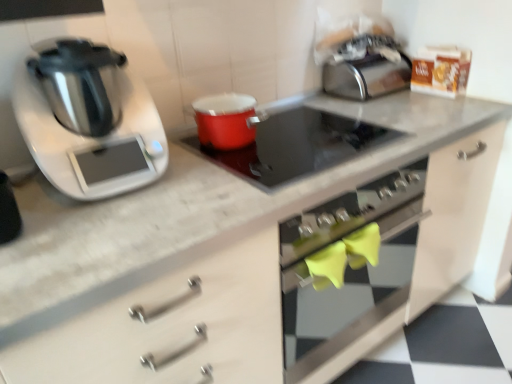
You are a GUI agent. You are given a task and a screenshot of the screen. Output one action in this format:
    pyautogui.click(x=<x>, y=<y>)
    Task: Click on the matte red pot at center
    This screenshot has width=512, height=384.
    Given the screenshot: What is the action you would take?
    pyautogui.click(x=226, y=120)

Measure the distance between point (x=354, y=50) and camera.

Point (x=354, y=50) is 5.39 feet from camera.

The width and height of the screenshot is (512, 384). What do you see at coordinates (366, 68) in the screenshot?
I see `satin silver toaster at upper right` at bounding box center [366, 68].

Locate an element on the screen. The image size is (512, 384). smooth glass cooktop at center is located at coordinates (296, 146).

Considering their positions, is matte red pot at center located in front of or behind shiny metallic pressure cooker at left?

Visually, matte red pot at center is located behind shiny metallic pressure cooker at left.

Is matte red pot at center turned away from shiny metallic pressure cooker at left?

That's not correct — matte red pot at center is not looking away from shiny metallic pressure cooker at left.

Is matte red pot at center spatially inside shiny metallic pressure cooker at left, or outside of it?

matte red pot at center is not inside shiny metallic pressure cooker at left, it's outside.

Between matte red pot at center and shiny metallic pressure cooker at left, which one has smaller width?

With smaller width is matte red pot at center.

What's the angular difference between satin silver toaster at upper right and matte red pot at center's facing directions?

The angle between the facing direction of satin silver toaster at upper right and the facing direction of matte red pot at center is 0.000762 degrees.

From a real-world perspective, which is physically below, satin silver toaster at upper right or matte red pot at center?

In real-world perspective, matte red pot at center is lower.

From the image's perspective, who appears lower, satin silver toaster at upper right or matte red pot at center?

matte red pot at center appears lower in the image.

Considering the sizes of objects shiny metallic pressure cooker at left and satin silver toaster at upper right in the image provided, who is thinner, shiny metallic pressure cooker at left or satin silver toaster at upper right?

satin silver toaster at upper right.

Considering the positions of point (87, 169) and point (371, 66), is point (87, 169) closer or farther from the camera than point (371, 66)?

Clearly, point (87, 169) is closer to the camera than point (371, 66).

You are a GUI agent. You are given a task and a screenshot of the screen. Output one action in this format:
    pyautogui.click(x=<x>, y=<y>)
    Task: Click on the kitchen appliance in front of the satin silver toaster at upper right
    
    Given the screenshot: What is the action you would take?
    pyautogui.click(x=88, y=120)

Is shiny metallic pressure cooker at left with satin silver toaster at upper right?

No, shiny metallic pressure cooker at left is not beside satin silver toaster at upper right.

Is matte red pot at center taller than satin silver toaster at upper right?

Incorrect, the height of matte red pot at center is not larger of that of satin silver toaster at upper right.

Which object is thinner, matte red pot at center or satin silver toaster at upper right?

With smaller width is satin silver toaster at upper right.

The width and height of the screenshot is (512, 384). Find the location of `appliance that appears below the satin silver toaster at upper right (from the image's perspective)`. appliance that appears below the satin silver toaster at upper right (from the image's perspective) is located at coordinates (226, 120).

Does matte red pot at center lie behind satin silver toaster at upper right?

No, it is in front of satin silver toaster at upper right.

The width and height of the screenshot is (512, 384). Find the location of `appliance above the smooth glass cooktop at center (from the image's perspective)`. appliance above the smooth glass cooktop at center (from the image's perspective) is located at coordinates (226, 120).

Which of these two, matte red pot at center or smooth glass cooktop at center, is wider?

Wider between the two is smooth glass cooktop at center.

Measure the distance between matte red pot at center and smooth glass cooktop at center.

matte red pot at center and smooth glass cooktop at center are 6.29 inches apart.

Based on the photo, is matte red pot at center far from smooth glass cooktop at center?

That's not correct — matte red pot at center is a little close to smooth glass cooktop at center.

Choose the correct answer: Is satin silver toaster at upper right inside shiny metallic pressure cooker at left or outside it?

satin silver toaster at upper right is not inside shiny metallic pressure cooker at left, it's outside.

Can you tell me how much satin silver toaster at upper right and shiny metallic pressure cooker at left differ in facing direction?

There is a 0.00152-degree angle between the facing directions of satin silver toaster at upper right and shiny metallic pressure cooker at left.

From the image's perspective, is satin silver toaster at upper right located beneath shiny metallic pressure cooker at left?

Incorrect, from the image's perspective, satin silver toaster at upper right is higher than shiny metallic pressure cooker at left.

Is satin silver toaster at upper right far away from shiny metallic pressure cooker at left?

No, satin silver toaster at upper right is not far away from shiny metallic pressure cooker at left.

Is satin silver toaster at upper right taller or shorter than smooth glass cooktop at center?

In the image, satin silver toaster at upper right appears to be taller than smooth glass cooktop at center.

In the scene shown: From the image's perspective, which one is positioned lower, satin silver toaster at upper right or smooth glass cooktop at center?

smooth glass cooktop at center is shown below in the image.

Is the position of satin silver toaster at upper right more distant than that of smooth glass cooktop at center?

Yes, the depth of satin silver toaster at upper right is greater than that of smooth glass cooktop at center.

Considering the sizes of satin silver toaster at upper right and smooth glass cooktop at center in the image, is satin silver toaster at upper right wider or thinner than smooth glass cooktop at center?

Considering their sizes, satin silver toaster at upper right looks slimmer than smooth glass cooktop at center.

This screenshot has height=384, width=512. I want to click on kitchen appliance that appears below the matte red pot at center (from the image's perspective), so click(88, 120).

Locate an element on the screen. Image resolution: width=512 pixels, height=384 pixels. toaster lying on the right of matte red pot at center is located at coordinates (366, 68).

Estimate the real-world distances between objects in this image. Which object is further from smooth glass cooktop at center, matte red pot at center or shiny metallic pressure cooker at left?

Among the two, shiny metallic pressure cooker at left is located further to smooth glass cooktop at center.

When comparing their distances from smooth glass cooktop at center, does satin silver toaster at upper right or shiny metallic pressure cooker at left seem closer?

shiny metallic pressure cooker at left is positioned closer to the anchor smooth glass cooktop at center.

Which object lies nearer to the anchor point shiny metallic pressure cooker at left, satin silver toaster at upper right or smooth glass cooktop at center?

Among the two, smooth glass cooktop at center is located nearer to shiny metallic pressure cooker at left.

From the image, which object appears to be nearer to satin silver toaster at upper right, shiny metallic pressure cooker at left or smooth glass cooktop at center?

Among the two, smooth glass cooktop at center is located nearer to satin silver toaster at upper right.

Estimate the real-world distances between objects in this image. Which object is closer to satin silver toaster at upper right, smooth glass cooktop at center or matte red pot at center?

smooth glass cooktop at center is closer to satin silver toaster at upper right.

From the image, which object appears to be nearer to smooth glass cooktop at center, shiny metallic pressure cooker at left or satin silver toaster at upper right?

Among the two, shiny metallic pressure cooker at left is located nearer to smooth glass cooktop at center.

When comparing their distances from matte red pot at center, does smooth glass cooktop at center or satin silver toaster at upper right seem further?

satin silver toaster at upper right.

From the image, which object appears to be nearer to shiny metallic pressure cooker at left, smooth glass cooktop at center or satin silver toaster at upper right?

smooth glass cooktop at center.

Where is `appliance situated between shiny metallic pressure cooker at left and smooth glass cooktop at center from left to right`? This screenshot has width=512, height=384. appliance situated between shiny metallic pressure cooker at left and smooth glass cooktop at center from left to right is located at coordinates (226, 120).

Find the location of a particular element. The image size is (512, 384). appliance situated between shiny metallic pressure cooker at left and satin silver toaster at upper right from left to right is located at coordinates (226, 120).

Where is `gas stove between shiny metallic pressure cooker at left and satin silver toaster at upper right`? gas stove between shiny metallic pressure cooker at left and satin silver toaster at upper right is located at coordinates (296, 146).

Image resolution: width=512 pixels, height=384 pixels. In order to click on gas stove between matte red pot at center and satin silver toaster at upper right in the horizontal direction in this screenshot , I will do `click(296, 146)`.